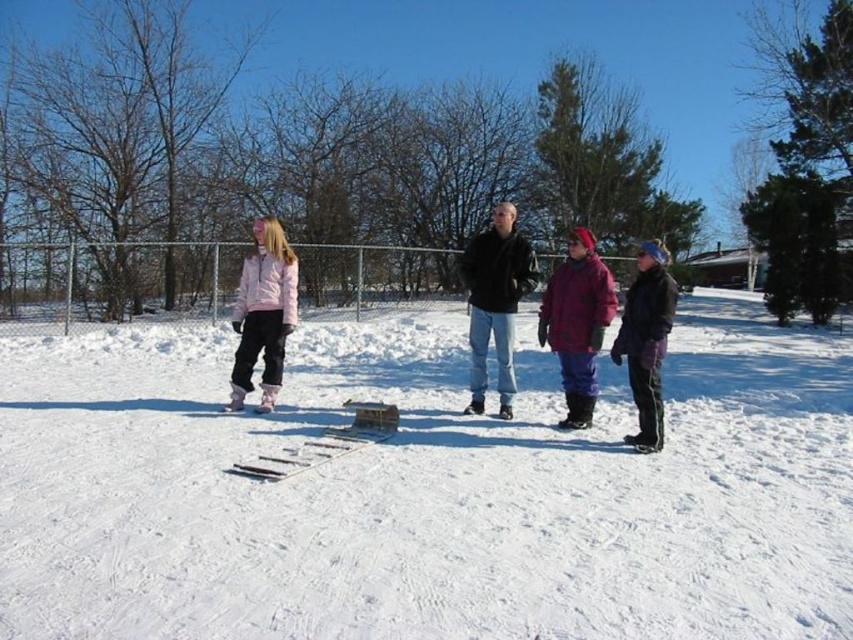
You are standing in the winter scene and want to walk from the white matte snow at center to the black matte jacket at center. Which direction should you move?

You should move to the right because the white matte snow at center is to the left of the black matte jacket at center.

You are a photographer trying to capture a group photo of the people in the winter scene. You need to ensure that both the white matte snow at center and the purple fleece jacket at right are clearly visible in the frame. Based on their positions, which object is closer to the left edge of the photo?

The white matte snow at center is positioned on the left side of the purple fleece jacket at right, so the white matte snow at center is closer to the left edge of the photo.